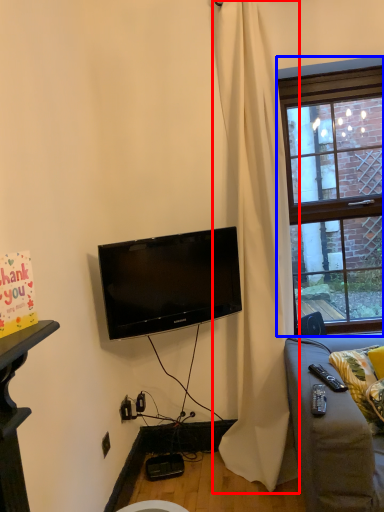
Question: Among these objects, which one is nearest to the camera, curtain (highlighted by a red box) or window (highlighted by a blue box)?

Choices:
 (A) curtain
 (B) window

Answer: (A)